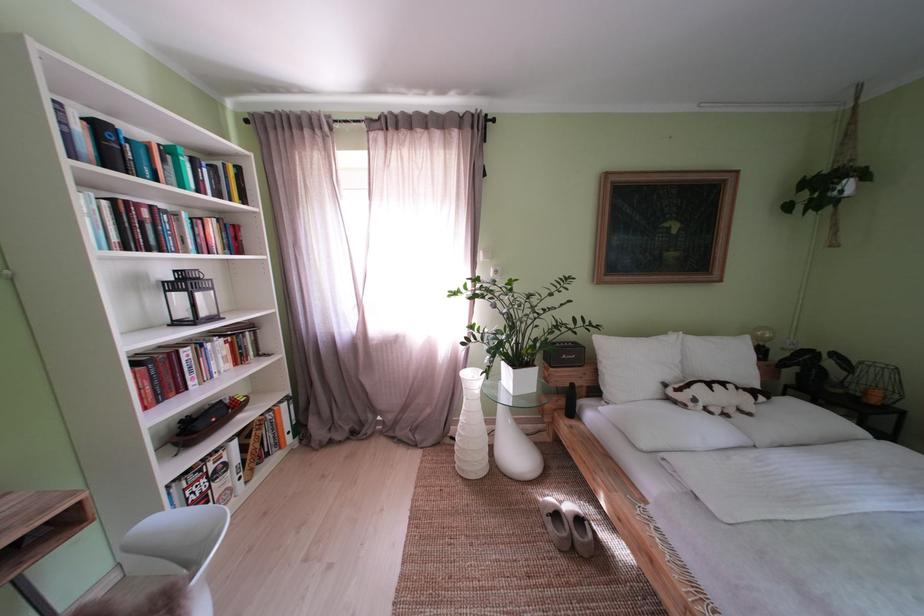
Which object does [715,397] point to?

It refers to a stuffed animal toy.